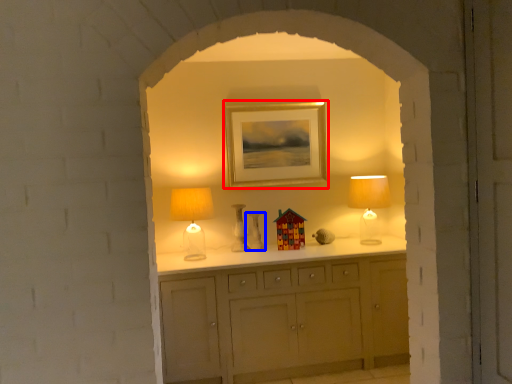
Question: Among these objects, which one is nearest to the camera, picture frame (highlighted by a red box) or vase (highlighted by a blue box)?

Choices:
 (A) picture frame
 (B) vase

Answer: (B)